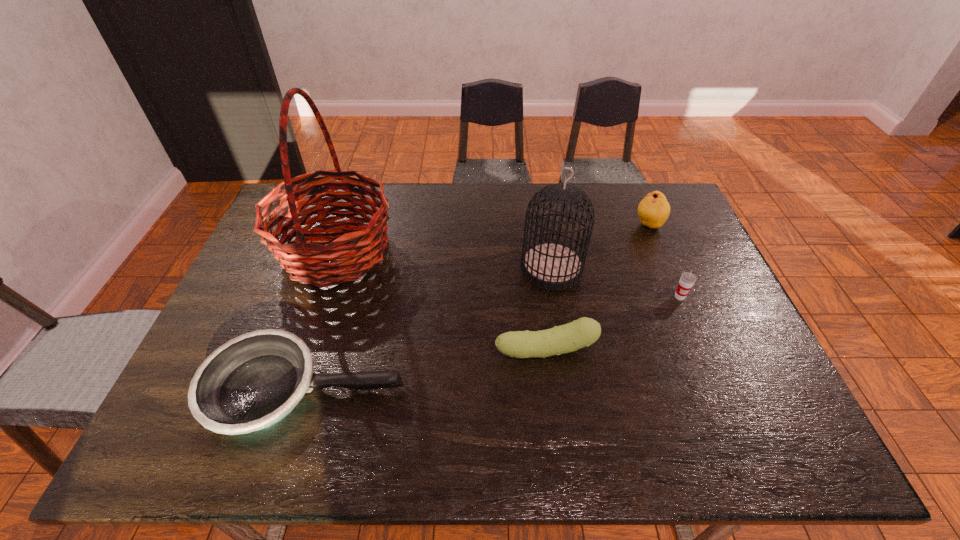
This screenshot has height=540, width=960. Find the location of `vacant space located on the left of the cucumber`. vacant space located on the left of the cucumber is located at coordinates (471, 350).

You are a GUI agent. You are given a task and a screenshot of the screen. Output one action in this format:
    pyautogui.click(x=<x>, y=<y>)
    Task: Click on the vacant region located on the handle side of the frying pan
    Image resolution: width=960 pixels, height=540 pixels.
    Given the screenshot: What is the action you would take?
    pyautogui.click(x=555, y=390)

This screenshot has height=540, width=960. In order to click on basket present at the far edge in this screenshot , I will do `click(306, 262)`.

You are a GUI agent. You are given a task and a screenshot of the screen. Output one action in this format:
    pyautogui.click(x=<x>, y=<y>)
    Task: Click on the pear present at the far edge
    The height and width of the screenshot is (540, 960).
    Given the screenshot: What is the action you would take?
    pyautogui.click(x=654, y=209)

Find the location of a particular element. Image resolution: width=960 pixels, height=540 pixels. object located at the near edge is located at coordinates (253, 381).

Find the location of a particular element. This screenshot has width=960, height=540. basket that is at the left edge is located at coordinates coord(306,262).

Identify the location of frying pan that is at the left edge. (253, 381).

Find the location of a particular element. The height and width of the screenshot is (540, 960). pear situated at the right edge is located at coordinates (654, 209).

I want to click on cup that is at the right edge, so click(x=687, y=279).

Where is `object present at the far left corner`? The height and width of the screenshot is (540, 960). object present at the far left corner is located at coordinates (306, 262).